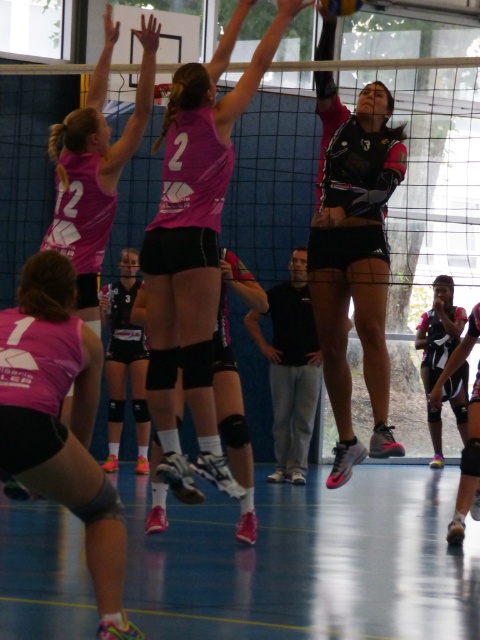
Question: Estimate the real-world distances between objects in this image. Which object is farther from the black matte uniform at center?

Choices:
 (A) pink matte volleyball net at center
 (B) pink matte shorts at lower left
 (C) pink matte jersey at upper left
 (D) shiny black volleyball at upper center

Answer: (B)

Question: Does black matte uniform at center appear on the left side of shiny black volleyball at upper center?

Choices:
 (A) yes
 (B) no

Answer: (B)

Question: In this image, where is pink matte jersey at upper left located relative to shiny black volleyball at upper center?

Choices:
 (A) below
 (B) above

Answer: (A)

Question: Is black mesh net at center wider than pink matte jersey at upper left?

Choices:
 (A) no
 (B) yes

Answer: (B)

Question: Which of the following is the closest to the observer?

Choices:
 (A) (327, 3)
 (B) (345, 328)
 (C) (310, 68)

Answer: (A)

Question: Which object is closer to the camera taking this photo?

Choices:
 (A) pink matte jersey at upper left
 (B) pink matte volleyball net at center
 (C) black matte uniform at center

Answer: (C)